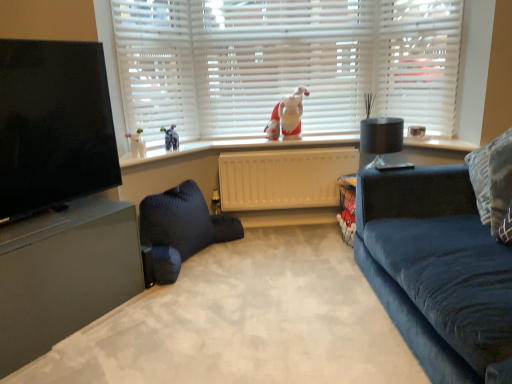
Question: Considering the relative positions of dark blue knitted bean bag at center and white plastic window frame at upper right in the image provided, is dark blue knitted bean bag at center behind white plastic window frame at upper right?

Choices:
 (A) no
 (B) yes

Answer: (A)

Question: Is dark blue knitted bean bag at center not inside white plastic window frame at upper right?

Choices:
 (A) yes
 (B) no

Answer: (A)

Question: Considering the relative sizes of dark blue knitted bean bag at center and white plastic window frame at upper right in the image provided, is dark blue knitted bean bag at center smaller than white plastic window frame at upper right?

Choices:
 (A) yes
 (B) no

Answer: (B)

Question: Considering the relative positions of dark blue knitted bean bag at center and white plastic window frame at upper right in the image provided, is dark blue knitted bean bag at center to the left of white plastic window frame at upper right from the viewer's perspective?

Choices:
 (A) yes
 (B) no

Answer: (A)

Question: From a real-world perspective, is dark blue knitted bean bag at center positioned over white plastic window frame at upper right based on gravity?

Choices:
 (A) no
 (B) yes

Answer: (A)

Question: From the image's perspective, is white plastic radiator at center above or below black matte lamp at right?

Choices:
 (A) below
 (B) above

Answer: (A)

Question: Does point (290, 180) appear closer or farther from the camera than point (371, 152)?

Choices:
 (A) closer
 (B) farther

Answer: (B)

Question: From a real-world perspective, is white plastic radiator at center physically located above or below black matte lamp at right?

Choices:
 (A) below
 (B) above

Answer: (A)

Question: In the image, is white plastic radiator at center positioned in front of or behind black matte lamp at right?

Choices:
 (A) behind
 (B) front

Answer: (A)

Question: Relative to patterned fabric pillow at right, is black matte lamp at right in front or behind?

Choices:
 (A) behind
 (B) front

Answer: (A)

Question: Considering the positions of point (399, 135) and point (506, 205), is point (399, 135) closer or farther from the camera than point (506, 205)?

Choices:
 (A) farther
 (B) closer

Answer: (A)

Question: Looking at the image, does black matte lamp at right seem bigger or smaller compared to patterned fabric pillow at right?

Choices:
 (A) small
 (B) big

Answer: (A)

Question: In terms of height, does black matte lamp at right look taller or shorter compared to patterned fabric pillow at right?

Choices:
 (A) tall
 (B) short

Answer: (B)

Question: Relative to white plastic radiator at center, is matte gray entertainment center at left in front or behind?

Choices:
 (A) front
 (B) behind

Answer: (A)

Question: Is point (11, 162) positioned closer to the camera than point (329, 175)?

Choices:
 (A) closer
 (B) farther

Answer: (A)